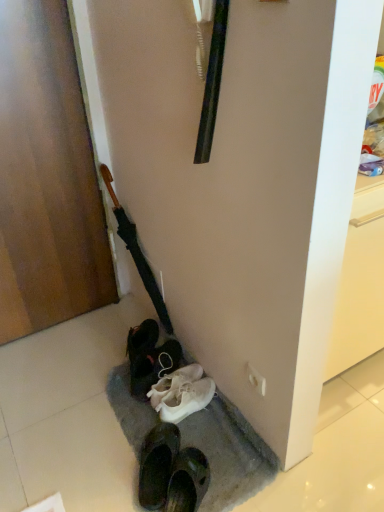
Question: Is the position of white matte sneakers at lower center more distant than that of black matte umbrella at left?

Choices:
 (A) yes
 (B) no

Answer: (A)

Question: From the image's perspective, would you say white matte sneakers at lower center is shown under black matte umbrella at left?

Choices:
 (A) no
 (B) yes

Answer: (B)

Question: Can you confirm if white matte sneakers at lower center is bigger than black matte umbrella at left?

Choices:
 (A) no
 (B) yes

Answer: (A)

Question: Would you say black matte umbrella at left is part of white matte sneakers at lower center's contents?

Choices:
 (A) no
 (B) yes

Answer: (A)

Question: From a real-world perspective, is white matte sneakers at lower center positioned under black matte umbrella at left based on gravity?

Choices:
 (A) yes
 (B) no

Answer: (A)

Question: From a real-world perspective, is white matte sneakers at lower center over black matte umbrella at left?

Choices:
 (A) no
 (B) yes

Answer: (A)

Question: Does wooden door at left appear on the right side of black matte umbrella at left?

Choices:
 (A) yes
 (B) no

Answer: (B)

Question: From a real-world perspective, is wooden door at left on top of black matte umbrella at left?

Choices:
 (A) yes
 (B) no

Answer: (A)

Question: Can you confirm if wooden door at left is bigger than black matte umbrella at left?

Choices:
 (A) yes
 (B) no

Answer: (A)

Question: Is the depth of wooden door at left less than that of black matte umbrella at left?

Choices:
 (A) yes
 (B) no

Answer: (A)

Question: Considering the relative sizes of wooden door at left and black matte umbrella at left in the image provided, is wooden door at left shorter than black matte umbrella at left?

Choices:
 (A) yes
 (B) no

Answer: (B)

Question: Considering the relative positions of wooden door at left and black matte umbrella at left in the image provided, is wooden door at left behind black matte umbrella at left?

Choices:
 (A) no
 (B) yes

Answer: (A)

Question: From a real-world perspective, does black matte umbrella at left stand above wooden door at left?

Choices:
 (A) no
 (B) yes

Answer: (A)